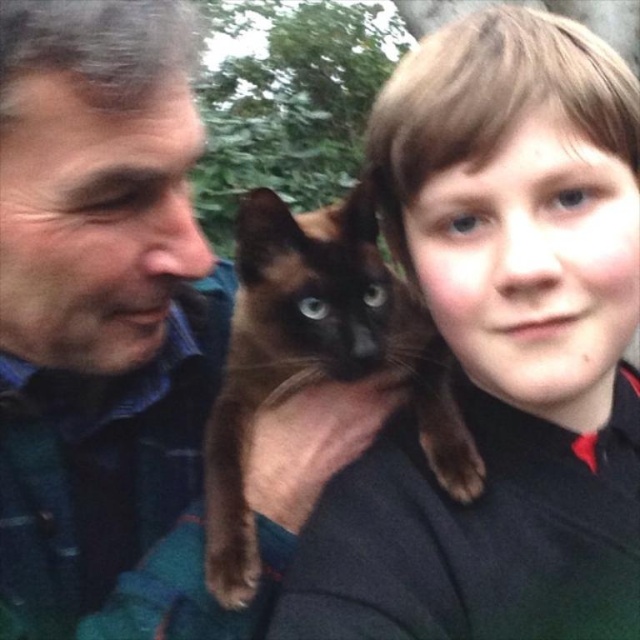
Question: Is brown fur cat at upper center to the right of brown fur cat at center from the viewer's perspective?

Choices:
 (A) no
 (B) yes

Answer: (B)

Question: Can you confirm if brown fur cat at upper center is positioned below brown fur cat at center?

Choices:
 (A) no
 (B) yes

Answer: (A)

Question: Is brown fur cat at upper center below brown fur cat at center?

Choices:
 (A) no
 (B) yes

Answer: (A)

Question: Which point is farther to the camera?

Choices:
 (A) (625, 276)
 (B) (230, 536)

Answer: (B)